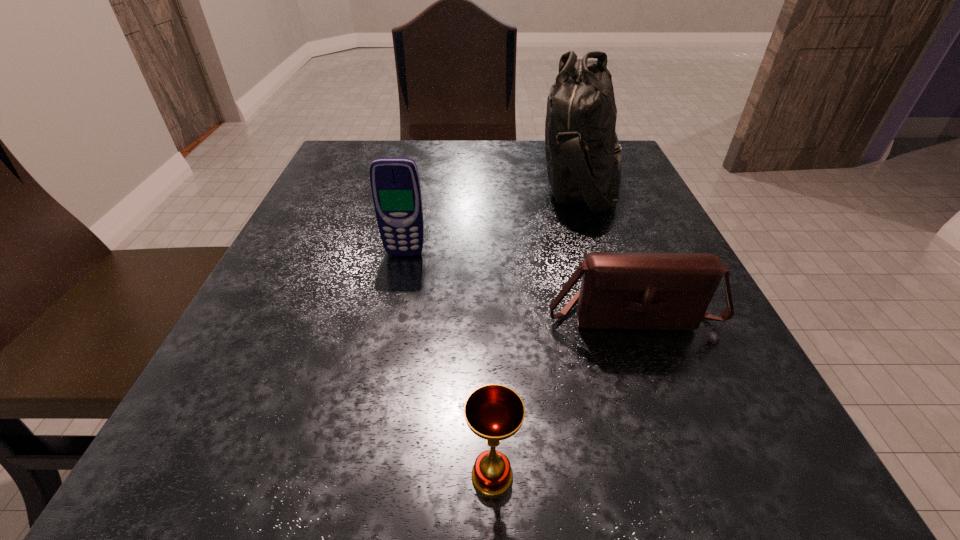
The height and width of the screenshot is (540, 960). Identify the location of the farther shoulder bag. (583, 155).

Identify the location of the tallest object. (583, 155).

Where is `the leftmost object`? The width and height of the screenshot is (960, 540). the leftmost object is located at coordinates (395, 185).

At what (x,y) coordinates should I click in order to perform the action: click on the second tallest object. Please return your answer as a coordinate pair (x, y). Image resolution: width=960 pixels, height=540 pixels. Looking at the image, I should click on (395, 185).

The image size is (960, 540). Identify the location of chalice. (494, 412).

The width and height of the screenshot is (960, 540). I want to click on the nearest object, so click(494, 412).

What are the coordinates of `the nearer shoulder bag` in the screenshot? It's located at (643, 291).

The image size is (960, 540). I want to click on the shorter shoulder bag, so click(x=643, y=291).

Image resolution: width=960 pixels, height=540 pixels. I want to click on vacant region located at the front padded panel of the taller shoulder bag, so click(x=492, y=179).

This screenshot has height=540, width=960. I want to click on free location located at the front padded panel of the taller shoulder bag, so click(x=510, y=179).